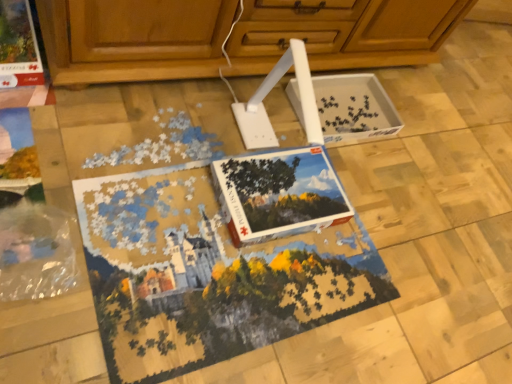
Question: From their relative heights in the image, would you say wooden cabinet at upper center is taller or shorter than white cardboard puzzle box at center, the 1th magazine from the right?

Choices:
 (A) tall
 (B) short

Answer: (A)

Question: Considering the positions of wooden cabinet at upper center and white cardboard puzzle box at center, which is the first magazine in bottom-to-top order, in the image, is wooden cabinet at upper center bigger or smaller than white cardboard puzzle box at center, which is the first magazine in bottom-to-top order,?

Choices:
 (A) big
 (B) small

Answer: (A)

Question: Which of these objects is positioned closest to the white cardboard puzzle box at center, the 1th magazine from the right?

Choices:
 (A) wooden cabinet at upper center
 (B) matte cardboard magazine at upper left, the 1th magazine from the left
 (C) white cardboard box at center

Answer: (C)

Question: Estimate the real-world distances between objects in this image. Which object is closer to the matte cardboard magazine at upper left, the 1th magazine from the left?

Choices:
 (A) wooden cabinet at upper center
 (B) white cardboard puzzle box at center, the 2th magazine from the top
 (C) white cardboard box at center

Answer: (A)